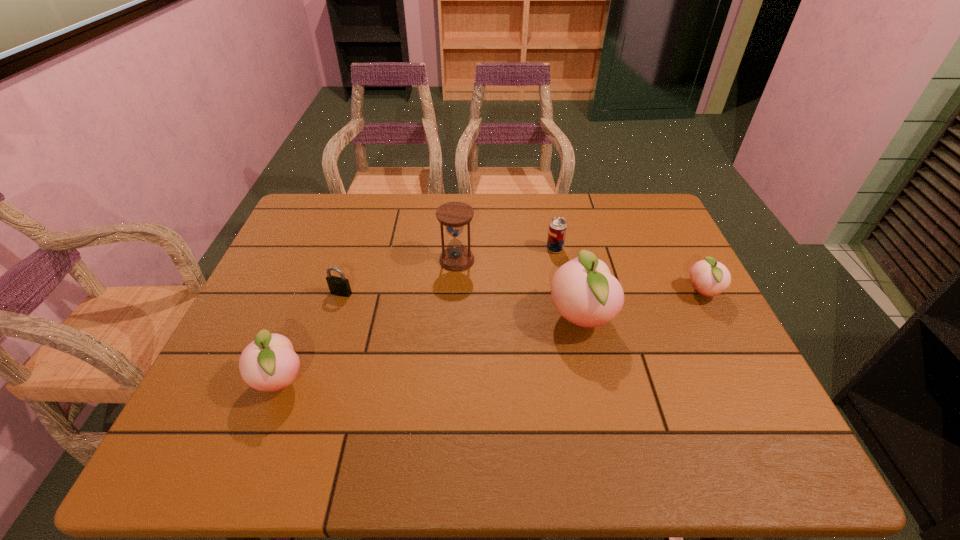
Identify the location of vacant space at the near edge. (620, 392).

Locate an element on the screen. Image resolution: width=960 pixels, height=540 pixels. vacant space at the right edge is located at coordinates (675, 333).

This screenshot has height=540, width=960. In the image, there is a desktop. In order to click on blank space at the far left corner in this screenshot , I will do `click(353, 197)`.

Locate an element on the screen. vacant space at the far right corner of the desktop is located at coordinates (660, 219).

The height and width of the screenshot is (540, 960). I want to click on free space at the near right corner of the desktop, so click(x=727, y=394).

Where is `vacant area that lies between the rightmost peach and the nearest peach`? This screenshot has width=960, height=540. vacant area that lies between the rightmost peach and the nearest peach is located at coordinates (492, 337).

Locate an element on the screen. vacant space in between the third object from left to right and the tallest peach is located at coordinates (518, 289).

Where is `free point between the third object from left to right and the nearest peach`? The image size is (960, 540). free point between the third object from left to right and the nearest peach is located at coordinates 369,320.

Where is `free space that is in between the second peach from right to left and the fourth shortest object`? free space that is in between the second peach from right to left and the fourth shortest object is located at coordinates coord(430,349).

Where is `unoccupied position between the second peach from right to left and the padlock`? The height and width of the screenshot is (540, 960). unoccupied position between the second peach from right to left and the padlock is located at coordinates (461, 306).